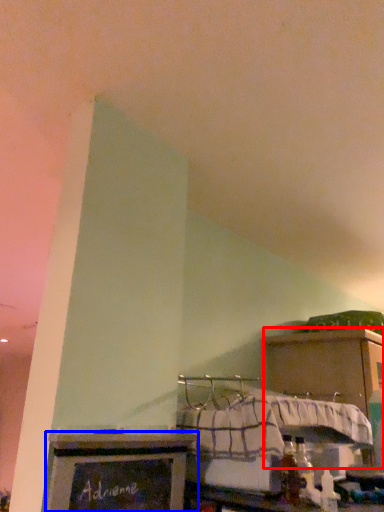
Question: Among these objects, which one is farthest to the camera, cabinetry (highlighted by a red box) or furniture (highlighted by a blue box)?

Choices:
 (A) cabinetry
 (B) furniture

Answer: (A)